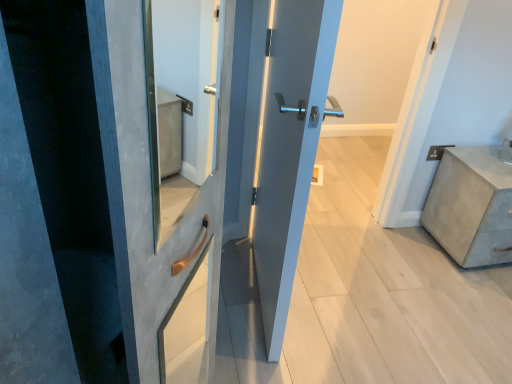
Question: Is satin blue door at center inside or outside of concrete textured chest of drawers at right?

Choices:
 (A) outside
 (B) inside

Answer: (A)

Question: Based on their sizes in the image, would you say satin blue door at center is bigger or smaller than concrete textured chest of drawers at right?

Choices:
 (A) small
 (B) big

Answer: (A)

Question: Does point (x=296, y=130) appear closer or farther from the camera than point (x=451, y=200)?

Choices:
 (A) closer
 (B) farther

Answer: (A)

Question: Considering the positions of concrete textured chest of drawers at right and satin blue door at center in the image, is concrete textured chest of drawers at right taller or shorter than satin blue door at center?

Choices:
 (A) short
 (B) tall

Answer: (A)

Question: In the image, is concrete textured chest of drawers at right on the left side or the right side of satin blue door at center?

Choices:
 (A) right
 (B) left

Answer: (A)

Question: Does point (437, 236) appear closer or farther from the camera than point (270, 284)?

Choices:
 (A) closer
 (B) farther

Answer: (B)

Question: Which is correct: concrete textured chest of drawers at right is inside satin blue door at center, or outside of it?

Choices:
 (A) inside
 (B) outside

Answer: (B)